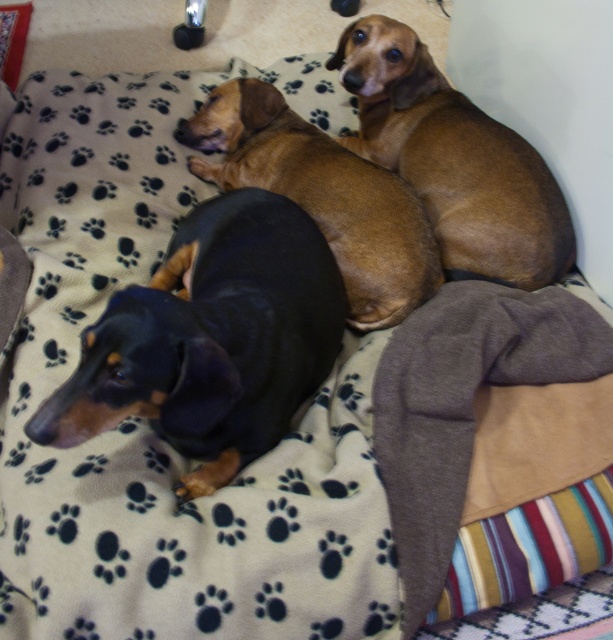
Is point (381, 145) positioned behind point (384, 224)?

Yes, it is.

Who is more forward, [408,131] or [383,291]?

Point [383,291] is more forward.

Where is `brown smooth dog at upper right`? brown smooth dog at upper right is located at coordinates 454,161.

Can you confirm if black smooth dog at left is smaller than brown smooth dog at upper center?

Correct, black smooth dog at left occupies less space than brown smooth dog at upper center.

Describe the element at coordinates (211, 339) in the screenshot. I see `black smooth dog at left` at that location.

Who is more forward, (91, 380) or (383, 301)?

Point (91, 380)

Find the location of a particular element. This screenshot has height=640, width=613. black smooth dog at left is located at coordinates (211, 339).

Is point (275, 240) less distant than point (506, 275)?

Yes, point (275, 240) is in front of point (506, 275).

Does black smooth dog at left appear under brown smooth dog at upper right?

Correct, black smooth dog at left is located below brown smooth dog at upper right.

Is point (219, 317) positioned behind point (517, 161)?

No, it is in front of (517, 161).

The width and height of the screenshot is (613, 640). Find the location of `black smooth dog at left`. black smooth dog at left is located at coordinates (211, 339).